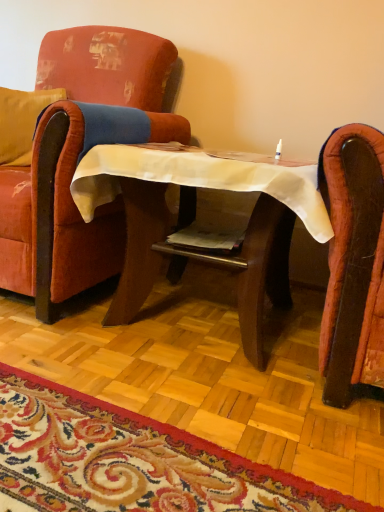
Find the location of a particular element. This screenshot has height=512, width=384. free point above carpet with floral pattern at lower center (from a real-world perspective) is located at coordinates (164, 324).